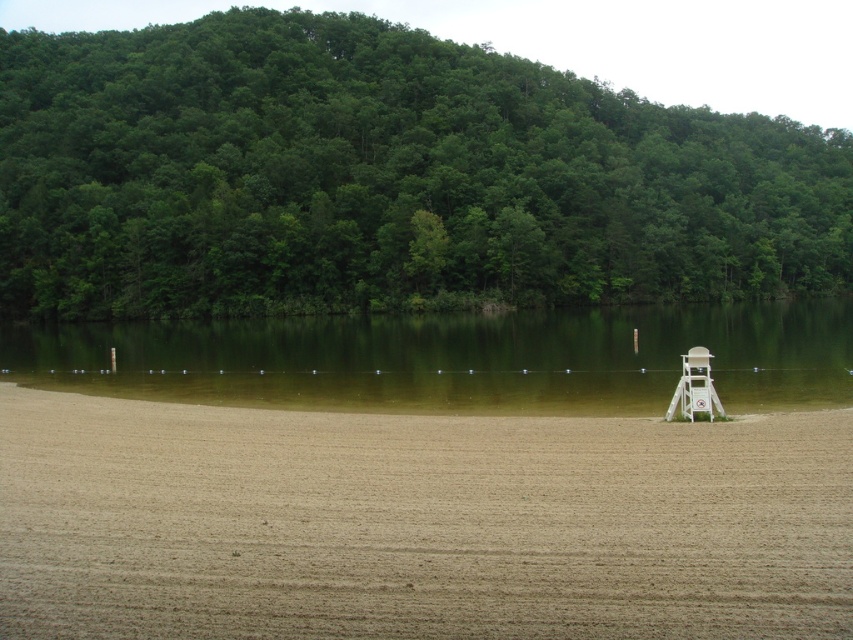
Which of these two, green leafy trees at upper center or green smooth water at center, stands taller?

green leafy trees at upper center

Is green leafy trees at upper center wider than green smooth water at center?

Yes, green leafy trees at upper center is wider than green smooth water at center.

In order to click on green leafy trees at upper center in this screenshot , I will do `click(383, 177)`.

Who is higher up, brown sandy beach at center or green smooth water at center?

green smooth water at center is above.

Who is more distant from viewer, [100,509] or [276,320]?

The point [276,320] is behind.

This screenshot has height=640, width=853. I want to click on brown sandy beach at center, so click(x=416, y=524).

Which is in front, point (756, 196) or point (20, 532)?

Point (20, 532) is more forward.

Locate an element on the screen. The image size is (853, 640). green leafy trees at upper center is located at coordinates (383, 177).